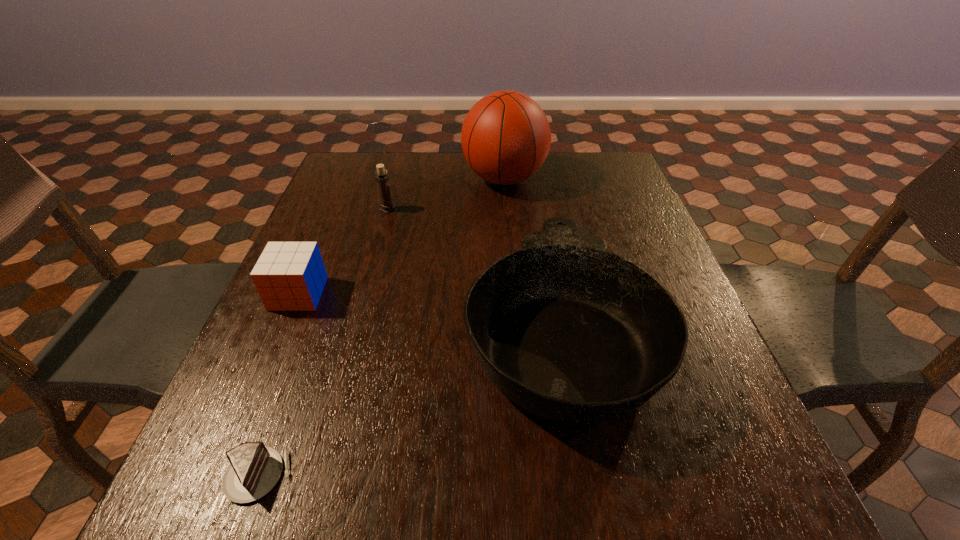
The height and width of the screenshot is (540, 960). What are the coordinates of `free region located with the handle extending from the side of the frying pan` in the screenshot? It's located at (541, 224).

Find the location of a particular element. The width and height of the screenshot is (960, 540). blank space located with the handle extending from the side of the frying pan is located at coordinates (537, 197).

Identify the location of vacant space located on the front of the fourth tallest object. (280, 337).

Identify the location of free space located on the right of the chocolate cake. (526, 475).

You are a GUI agent. You are given a task and a screenshot of the screen. Output one action in this format:
    pyautogui.click(x=<x>, y=<y>)
    Task: Click on the object present at the far edge
    This screenshot has height=540, width=960.
    Given the screenshot: What is the action you would take?
    pyautogui.click(x=506, y=137)

Image resolution: width=960 pixels, height=540 pixels. What are the coordinates of `object present at the near edge` in the screenshot? It's located at (254, 469).

Where is `cube present at the left edge`? The image size is (960, 540). cube present at the left edge is located at coordinates (289, 276).

Identify the location of chocolate cake that is at the left edge. (254, 469).

Locate an element on the screen. This screenshot has width=960, height=540. object at the right edge is located at coordinates (568, 331).

Where is `object situated at the near left corner`? Image resolution: width=960 pixels, height=540 pixels. object situated at the near left corner is located at coordinates (254, 469).